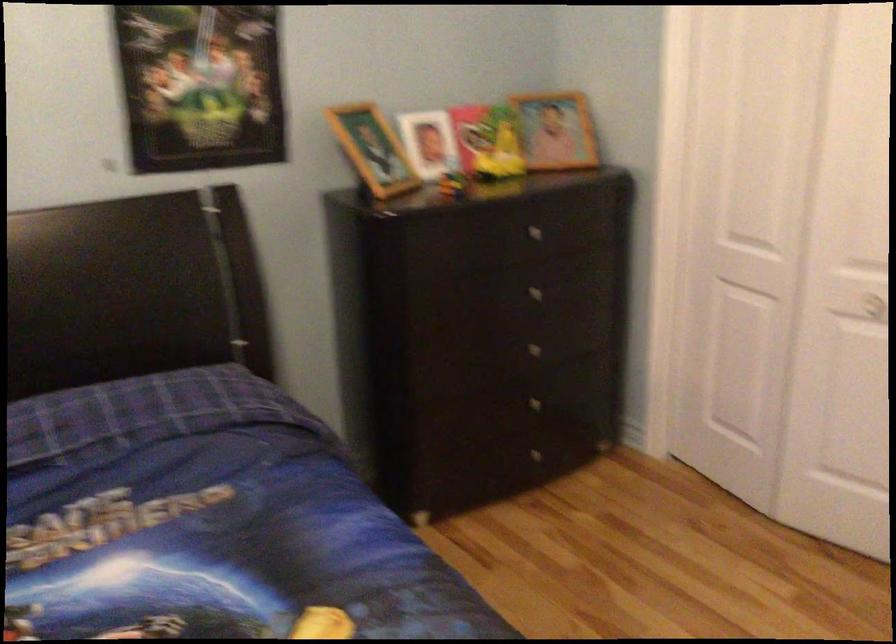
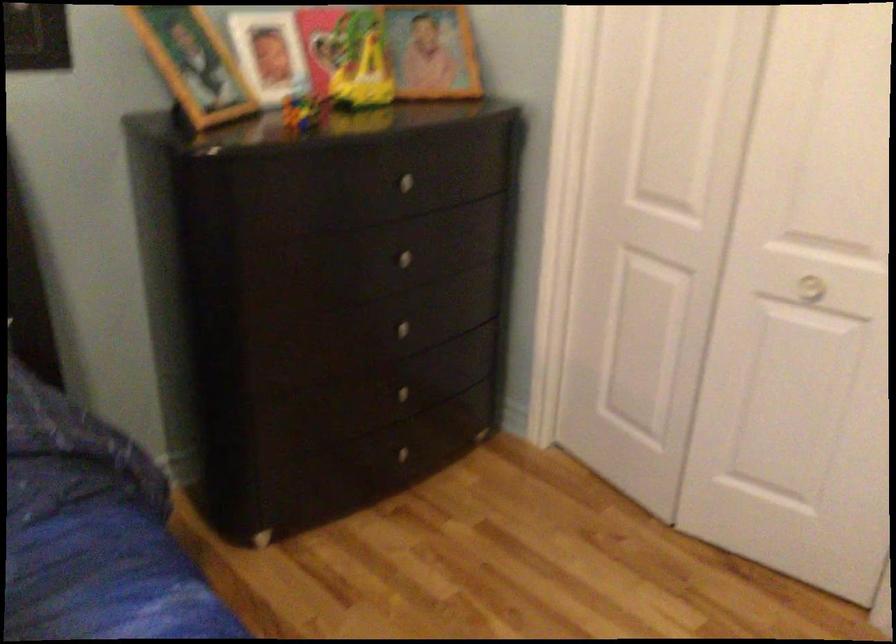
In the second image, find the point that corresponds to point (530, 290) in the first image.

(399, 258)